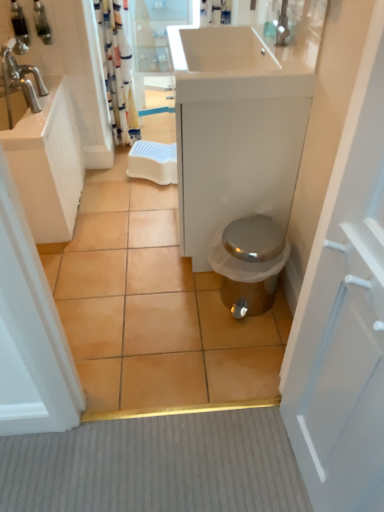
Question: Considering the relative sizes of striped fabric shower curtain at upper left and white glossy sink at upper left in the image provided, is striped fabric shower curtain at upper left smaller than white glossy sink at upper left?

Choices:
 (A) yes
 (B) no

Answer: (A)

Question: Can you confirm if striped fabric shower curtain at upper left is shorter than white glossy sink at upper left?

Choices:
 (A) no
 (B) yes

Answer: (A)

Question: Considering the relative positions of striped fabric shower curtain at upper left and white glossy sink at upper left in the image provided, is striped fabric shower curtain at upper left in front of white glossy sink at upper left?

Choices:
 (A) yes
 (B) no

Answer: (B)

Question: Is striped fabric shower curtain at upper left outside white glossy sink at upper left?

Choices:
 (A) yes
 (B) no

Answer: (A)

Question: From a real-world perspective, does striped fabric shower curtain at upper left sit lower than white glossy sink at upper left?

Choices:
 (A) no
 (B) yes

Answer: (B)

Question: Considering the positions of silver metallic toilet at center and transparent glass door at upper center in the image, is silver metallic toilet at center bigger or smaller than transparent glass door at upper center?

Choices:
 (A) big
 (B) small

Answer: (B)

Question: From a real-world perspective, is silver metallic toilet at center positioned above or below transparent glass door at upper center?

Choices:
 (A) above
 (B) below

Answer: (B)

Question: Is silver metallic toilet at center inside or outside of transparent glass door at upper center?

Choices:
 (A) inside
 (B) outside

Answer: (B)

Question: From the image's perspective, is silver metallic toilet at center above or below transparent glass door at upper center?

Choices:
 (A) below
 (B) above

Answer: (A)

Question: Looking at their shapes, would you say silver metallic toilet at center is wider or thinner than brushed metal soap dispenser at upper left, acting as the 1th toiletry starting from the left?

Choices:
 (A) thin
 (B) wide

Answer: (B)

Question: Is point (238, 269) closer or farther from the camera than point (18, 11)?

Choices:
 (A) farther
 (B) closer

Answer: (B)

Question: Is silver metallic toilet at center taller or shorter than brushed metal soap dispenser at upper left, the 2th toiletry when ordered from right to left?

Choices:
 (A) tall
 (B) short

Answer: (A)

Question: In terms of size, does silver metallic toilet at center appear bigger or smaller than brushed metal soap dispenser at upper left, the 2th toiletry when ordered from right to left?

Choices:
 (A) big
 (B) small

Answer: (A)

Question: Relative to brown ceramic tile at center, is white glossy sink at upper center in front or behind?

Choices:
 (A) behind
 (B) front

Answer: (B)

Question: Considering the positions of white glossy sink at upper center and brown ceramic tile at center in the image, is white glossy sink at upper center taller or shorter than brown ceramic tile at center?

Choices:
 (A) short
 (B) tall

Answer: (B)